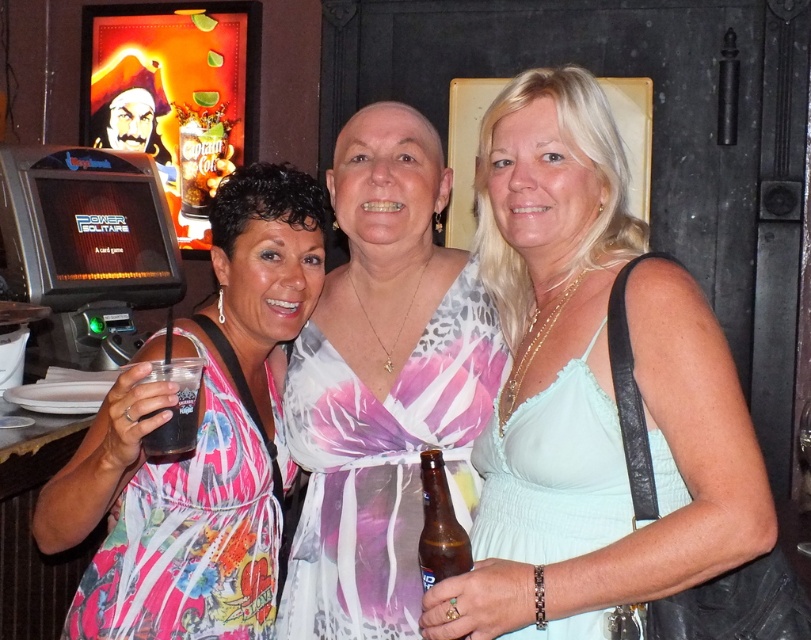
Can you confirm if printed fabric dress at center is wider than shiny pirate head at upper left?

Yes.

The width and height of the screenshot is (811, 640). I want to click on printed fabric dress at center, so coord(382,385).

Identify the location of printed fabric dress at center. The width and height of the screenshot is (811, 640). (382, 385).

What do you see at coordinates (200, 440) in the screenshot? I see `floral dress at center` at bounding box center [200, 440].

Which of these two, floral dress at center or translucent plastic cup at left, stands taller?

With more height is floral dress at center.

Which is in front, point (151, 522) or point (168, 442)?

Point (168, 442)

The height and width of the screenshot is (640, 811). In order to click on floral dress at center in this screenshot , I will do click(x=200, y=440).

Is point (303, 604) farther from viewer compared to point (427, 465)?

That is True.

Is printed fabric dress at center above brown glass bottle at center?

Yes, printed fabric dress at center is above brown glass bottle at center.

Locate an element on the screen. This screenshot has width=811, height=640. printed fabric dress at center is located at coordinates (382, 385).